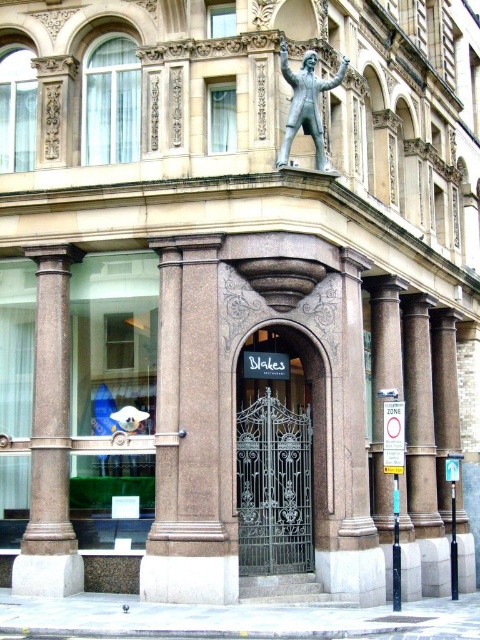
Question: Does sanded stone column at center have a larger size compared to silver/statue at upper center?

Choices:
 (A) yes
 (B) no

Answer: (A)

Question: Does green wrought iron gate at center have a smaller size compared to silver/statue at upper center?

Choices:
 (A) yes
 (B) no

Answer: (B)

Question: Which point appears closest to the camera in this image?

Choices:
 (A) (176, 269)
 (B) (46, 540)
 (C) (323, 147)
 (D) (294, 426)

Answer: (B)

Question: Which object is the farthest from the silver/statue at upper center?

Choices:
 (A) brown polished stone column at left
 (B) sanded stone column at center
 (C) green wrought iron gate at center

Answer: (A)

Question: Is green wrought iron gate at center further to the viewer compared to silver/statue at upper center?

Choices:
 (A) yes
 (B) no

Answer: (B)

Question: Considering the real-world distances, which object is farthest from the silver/statue at upper center?

Choices:
 (A) green wrought iron gate at center
 (B) brown polished stone column at left
 (C) sanded stone column at center

Answer: (B)